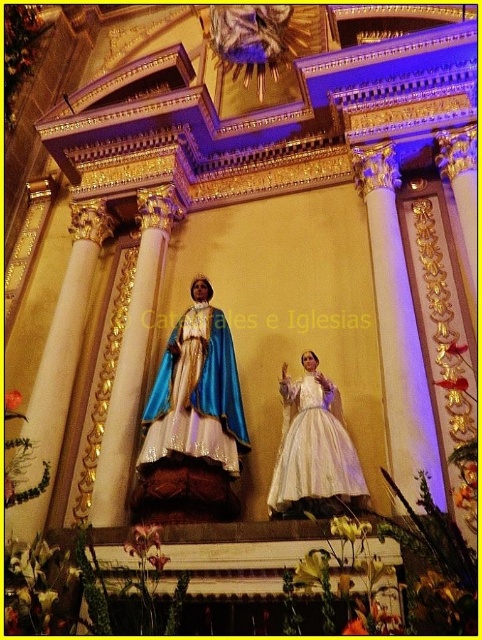
You are standing in the grand church and want to locate the blue satin dress at center. Based on the coordinates provided, where should you look relative to the other statues and altars?

The blue satin dress at center is located at coordinates point [197,394], which places it centrally in the image, likely positioned between the statue of the saint on the pedestal and the golden altar in the background.

Based on the photo, you are an interior designer planning to add a new decorative element between the blue satin dress at center and the white satin dress at center. Based on their positions, which dress should you place the new element closer to?

The white satin dress at center is behind the blue satin dress at center, so the new decorative element should be placed closer to the blue satin dress at center to maintain visual balance between the two dresses.